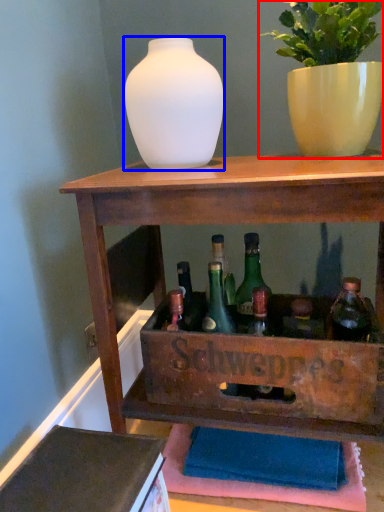
Question: Which of the following is the farthest to the observer, houseplant (highlighted by a red box) or vase (highlighted by a blue box)?

Choices:
 (A) houseplant
 (B) vase

Answer: (B)